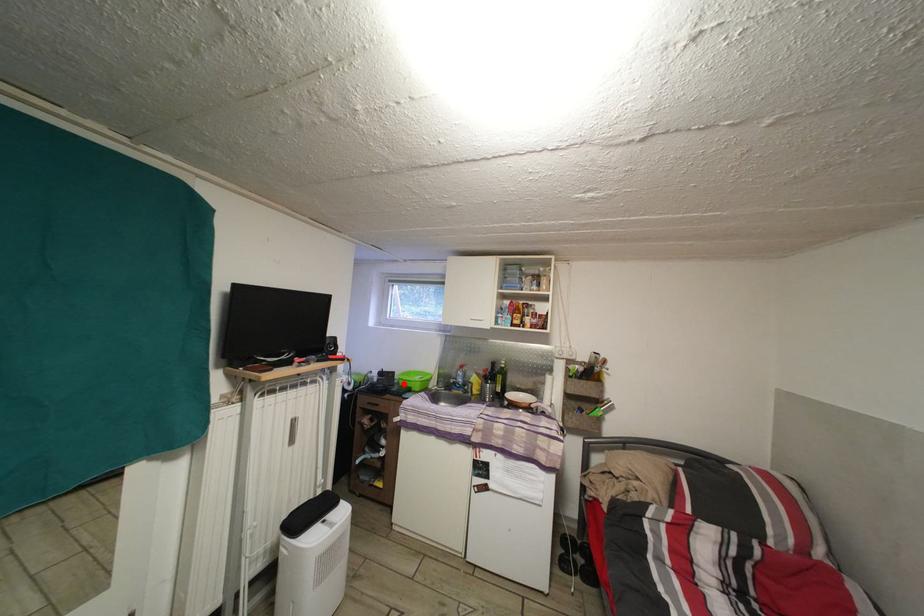
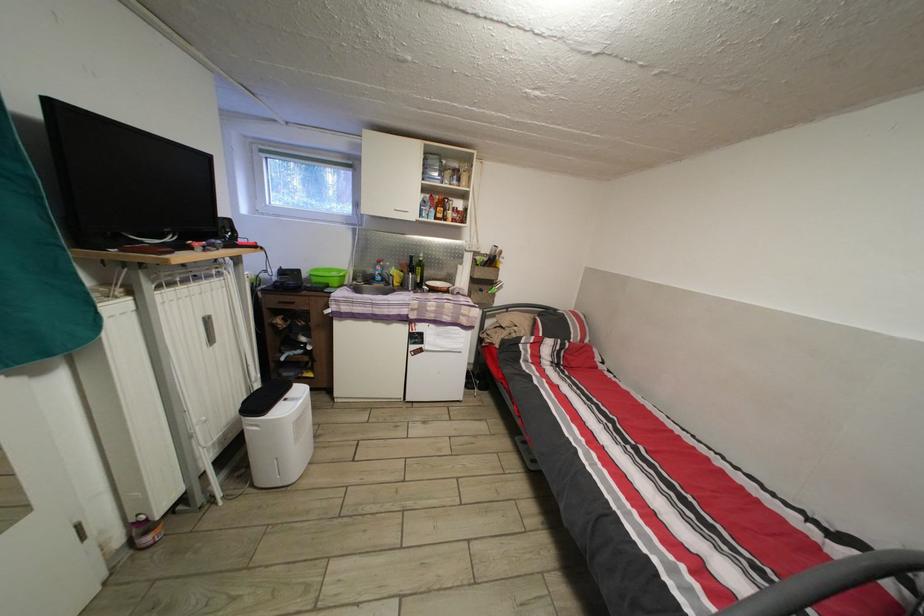
The point at the highlighted location is marked in the first image. Where is the corresponding point in the second image?

(311, 282)